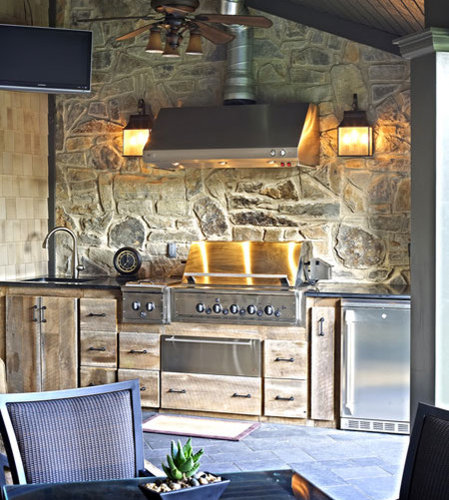
The width and height of the screenshot is (449, 500). Find the location of `plant`. plant is located at coordinates (182, 465).